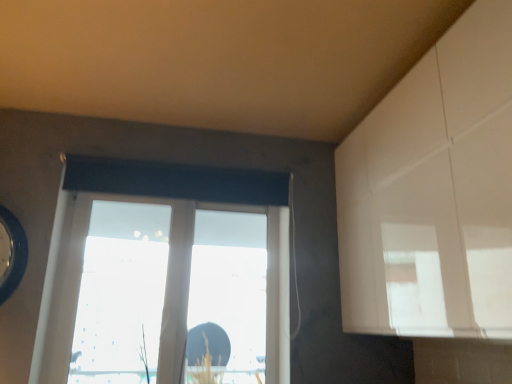
Image resolution: width=512 pixels, height=384 pixels. What do you see at coordinates (164, 272) in the screenshot?
I see `transparent glass window at center` at bounding box center [164, 272].

Image resolution: width=512 pixels, height=384 pixels. I want to click on transparent glass window at center, so click(x=164, y=272).

What is the approximate width of transparent glass window at center?

transparent glass window at center is 3.93 inches in width.

Identify the location of transparent glass window at center. (164, 272).